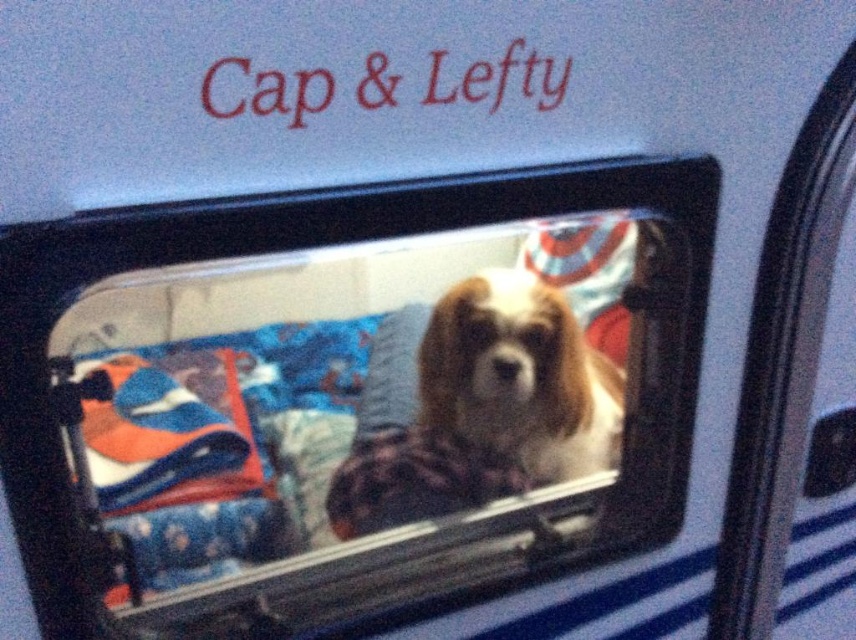
Between clear glass dog at center and white fur dog at center, which one has less height?

With less height is white fur dog at center.

Does clear glass dog at center appear on the left side of white fur dog at center?

Yes, clear glass dog at center is to the left of white fur dog at center.

Between point (296, 307) and point (494, 372), which one is positioned in front?

Point (296, 307)

Image resolution: width=856 pixels, height=640 pixels. I want to click on clear glass dog at center, so click(x=317, y=349).